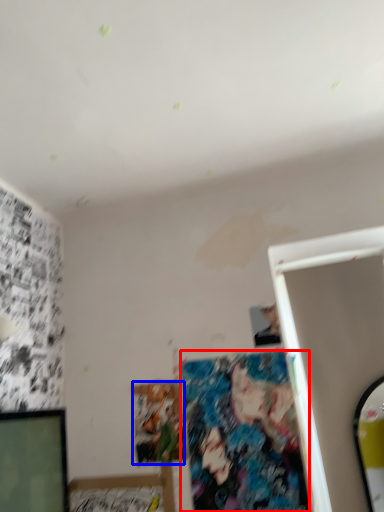
Question: Which of the following is the farthest to the observer, art (highlighted by a red box) or art (highlighted by a blue box)?

Choices:
 (A) art
 (B) art

Answer: (B)